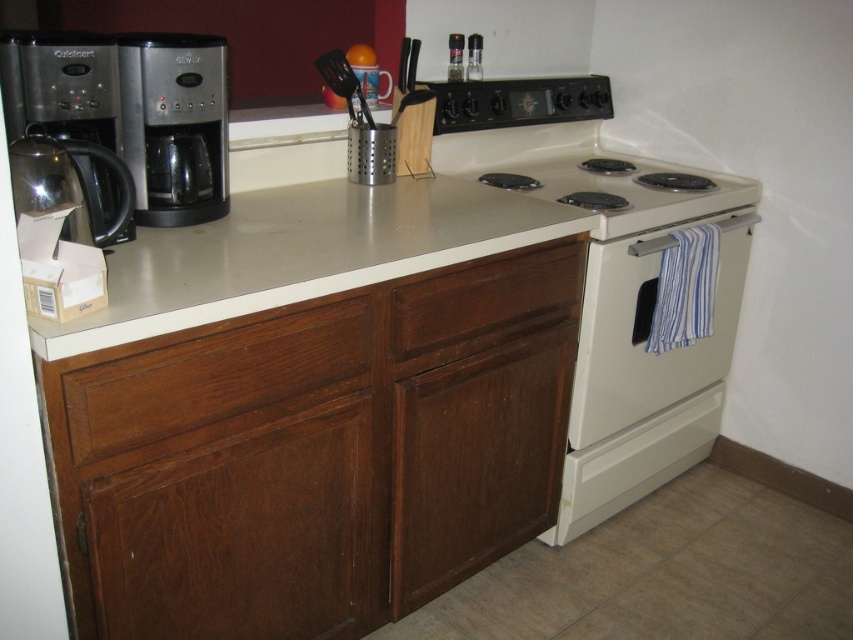
Question: Can you confirm if wooden drawer at center is positioned to the right of white glossy electric stove at center?

Choices:
 (A) no
 (B) yes

Answer: (A)

Question: Does wooden drawer at lower left have a larger size compared to white glossy electric stove at center?

Choices:
 (A) no
 (B) yes

Answer: (A)

Question: Among these objects, which one is nearest to the camera?

Choices:
 (A) wooden drawer at lower left
 (B) sleek metallic coffee maker at left

Answer: (A)

Question: Can you confirm if white glossy oven at center is positioned below white glossy electric stove at center?

Choices:
 (A) no
 (B) yes

Answer: (B)

Question: Considering the real-world distances, which object is farthest from the sleek metallic coffee maker at left?

Choices:
 (A) smooth gray countertop at center
 (B) stainless steel coffee maker at left
 (C) white glossy oven at center
 (D) wooden drawer at center

Answer: (C)

Question: Which point appears closest to the camera in this image?

Choices:
 (A) (427, 337)
 (B) (73, 32)
 (C) (599, 260)

Answer: (B)